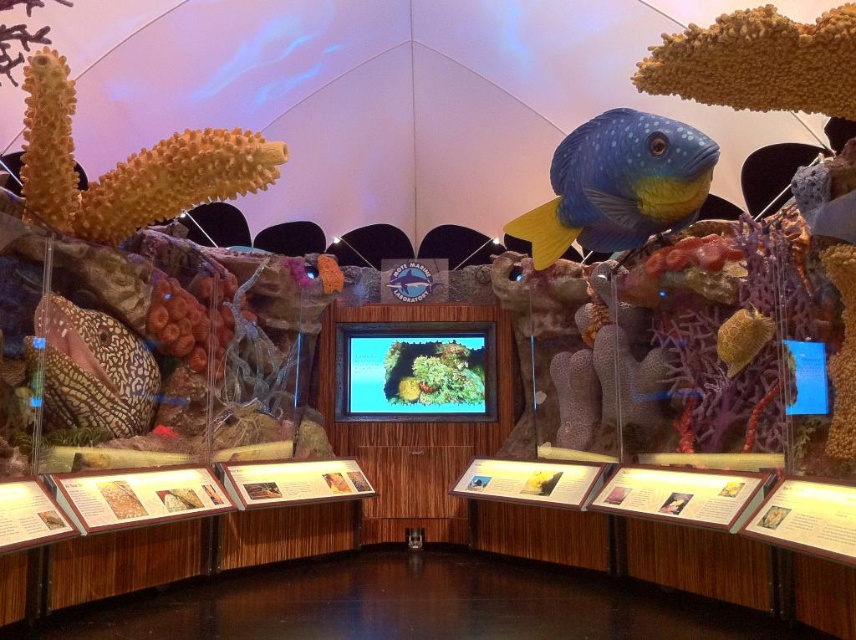
Question: Can you confirm if blue matte fish at center is positioned above smooth yellowish-brown seashell at right?

Choices:
 (A) yes
 (B) no

Answer: (A)

Question: Which object is positioned farthest from the blue matte fish at center?

Choices:
 (A) smooth yellowish-brown seashell at right
 (B) speckled gold fish at left

Answer: (B)

Question: Is speckled gold fish at left positioned before smooth yellowish-brown seashell at right?

Choices:
 (A) no
 (B) yes

Answer: (B)

Question: Does blue matte fish at center lie in front of smooth yellowish-brown seashell at right?

Choices:
 (A) yes
 (B) no

Answer: (B)

Question: Estimate the real-world distances between objects in this image. Which object is closer to the smooth yellowish-brown seashell at right?

Choices:
 (A) speckled gold fish at left
 (B) blue matte fish at center

Answer: (B)

Question: Estimate the real-world distances between objects in this image. Which object is closer to the blue matte fish at center?

Choices:
 (A) smooth yellowish-brown seashell at right
 (B) speckled gold fish at left

Answer: (A)